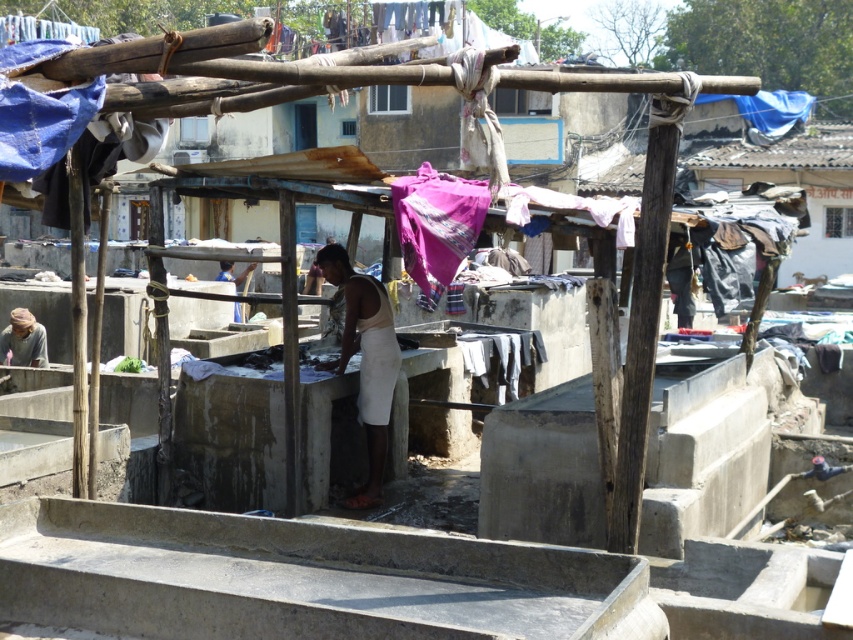
You are a laundry service worker who needs to retrieve the white cotton dress at lower center and the white cotton cloth at center. Given that you can only reach up to 6 feet, will you be able to reach both items without any assistance?

The distance between the white cotton cloth at center and the white cotton dress at lower center is 14.79 feet. Since you can only reach up to 6 feet, you cannot reach both items without assistance because the distance between them exceeds your reach capability.